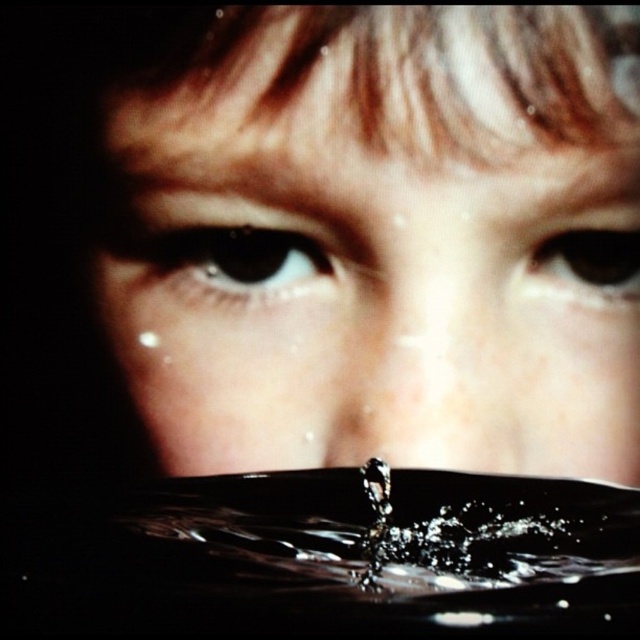
This screenshot has width=640, height=640. What do you see at coordinates (378, 241) in the screenshot?
I see `smooth skin face at center` at bounding box center [378, 241].

Is smooth skin face at center thinner than brown glossy eye at upper right?

No, smooth skin face at center is not thinner than brown glossy eye at upper right.

At what (x,y) coordinates should I click in order to perform the action: click on smooth skin face at center. Please return your answer as a coordinate pair (x, y). This screenshot has height=640, width=640. Looking at the image, I should click on (378, 241).

Is brown glossy eye at center positioned in front of brown glossy eye at upper right?

Yes, brown glossy eye at center is in front of brown glossy eye at upper right.

Can you confirm if brown glossy eye at center is thinner than brown glossy eye at upper right?

Incorrect, brown glossy eye at center's width is not less than brown glossy eye at upper right's.

Does point (252, 280) lie in front of point (572, 253)?

Yes, it is.

This screenshot has width=640, height=640. I want to click on brown glossy eye at center, so click(x=243, y=259).

Can you confirm if smooth skin face at center is positioned to the left of brown glossy eye at center?

In fact, smooth skin face at center is to the right of brown glossy eye at center.

Can you confirm if smooth skin face at center is positioned below brown glossy eye at center?

Incorrect, smooth skin face at center is not positioned below brown glossy eye at center.

Where is `smooth skin face at center`? The image size is (640, 640). smooth skin face at center is located at coordinates (378, 241).

Identify the location of smooth skin face at center. This screenshot has width=640, height=640. (378, 241).